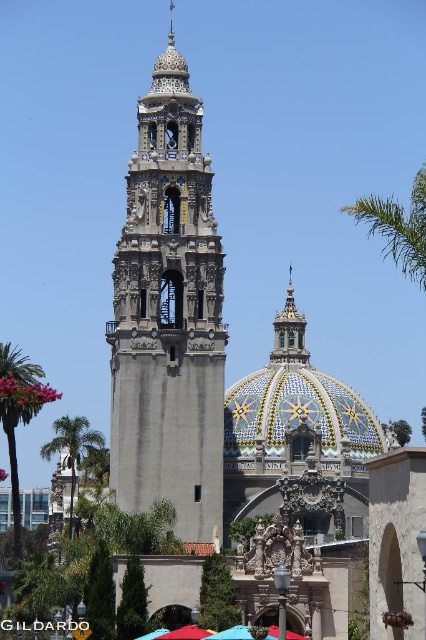
Is point (337, 445) closer to camera compared to point (57, 429)?

No, (337, 445) is behind (57, 429).

Locate an element on the screen. Image resolution: width=426 pixels, height=640 pixels. multicolored mosaic dome at center is located at coordinates [x=296, y=400].

The image size is (426, 640). I want to click on multicolored mosaic dome at center, so click(296, 400).

Can you confirm if matte gray stone bell tower at center is bigger than multicolored mosaic dome at center?

Yes.

Is point (218, 308) positioned before point (322, 388)?

That is True.

Describe the element at coordinates (169, 316) in the screenshot. I see `matte gray stone bell tower at center` at that location.

The image size is (426, 640). I want to click on matte gray stone bell tower at center, so pos(169,316).

From the picture: Does matte gray stone bell tower at center have a greater height compared to green leafy palm tree at upper right?

Yes.

Between matte gray stone bell tower at center and green leafy palm tree at upper right, which one is positioned lower?

green leafy palm tree at upper right is lower down.

Which is in front, point (155, 68) or point (425, 186)?

Point (425, 186) is in front.

I want to click on matte gray stone bell tower at center, so click(169, 316).